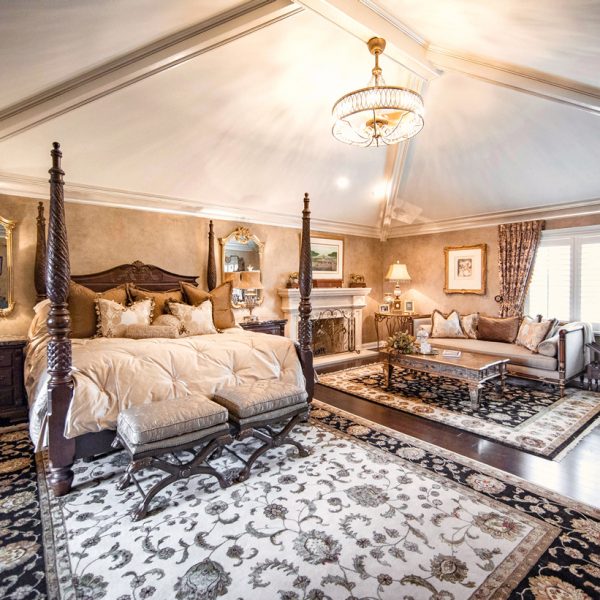
At what (x,y) coordinates should I click in order to perform the action: click on mirrow. Please return your answer as a coordinate pair (x, y). This screenshot has height=600, width=600. Looking at the image, I should click on (240, 244).